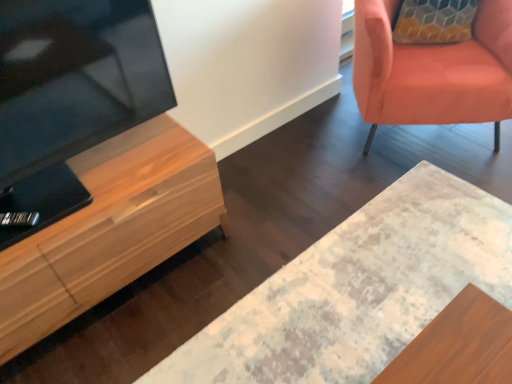
You are a GUI agent. You are given a task and a screenshot of the screen. Output one action in this format:
    pyautogui.click(x=<x>, y=<y>)
    Task: Click on the free space behind distressed wood desk at center
    The image size is (512, 384).
    Given the screenshot: What is the action you would take?
    pyautogui.click(x=326, y=171)